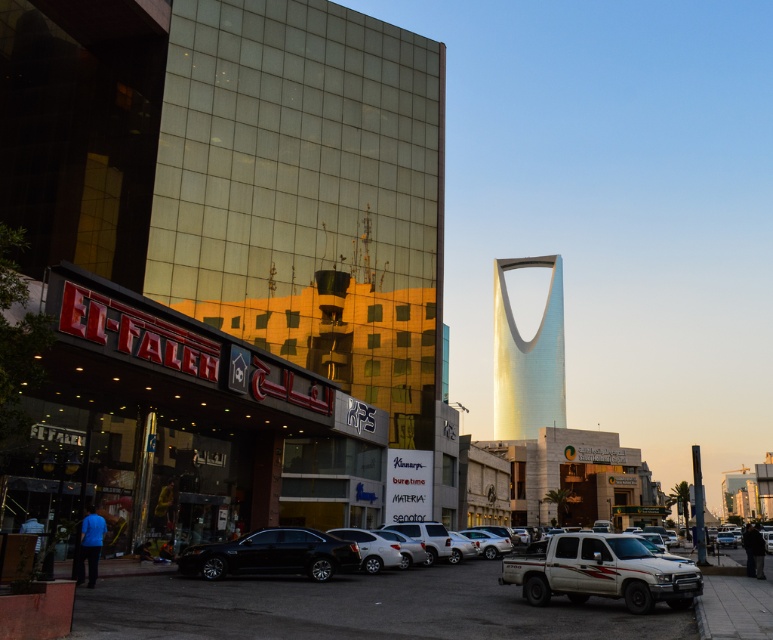
You are standing in the middle of the city square facing the modern commercial building with reflective glass windows. There is a point marked at coordinates (225, 264). Which building does this point correspond to?

The point at (225, 264) corresponds to the metallic glass building at center.

You are standing at the point marked by the coordinates point (600,572) in the image. What object are you standing on?

The point (600,572) corresponds to the white matte truck at lower center, so you are standing on the white matte truck at lower center.